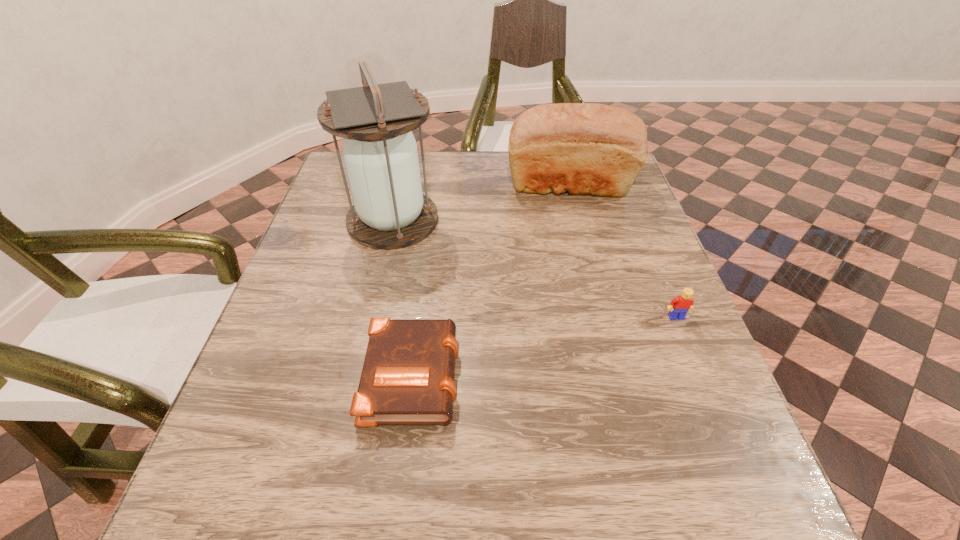
In the image, there is a desktop. Identify the location of vacant space at the near left corner. (286, 524).

Find the location of `vacant space at the near right corner of the desktop`. vacant space at the near right corner of the desktop is located at coordinates (675, 515).

At what (x,y) coordinates should I click in order to perform the action: click on free point between the nearest object and the Lego. Please return your answer as a coordinate pair (x, y). This screenshot has width=960, height=540. Looking at the image, I should click on (544, 345).

Identify the location of free area in between the second tallest object and the nearest object. (491, 279).

Find the location of `free area in between the bread and the shortest object`. free area in between the bread and the shortest object is located at coordinates tap(491, 279).

Where is `unoccupied position between the lantern and the second tallest object`? This screenshot has height=540, width=960. unoccupied position between the lantern and the second tallest object is located at coordinates (481, 202).

Identify the location of free space between the nearest object and the second tallest object. Image resolution: width=960 pixels, height=540 pixels. (491, 279).

The height and width of the screenshot is (540, 960). I want to click on vacant area that lies between the third farthest object and the lantern, so click(535, 269).

You are a GUI agent. You are given a task and a screenshot of the screen. Output one action in this format:
    pyautogui.click(x=<x>, y=<y>)
    Task: Click on the vacant space that is in between the nearest object and the lantern
    The width and height of the screenshot is (960, 540).
    Given the screenshot: What is the action you would take?
    pyautogui.click(x=403, y=296)

This screenshot has height=540, width=960. I want to click on free space between the second nearest object and the tallest object, so click(x=535, y=269).